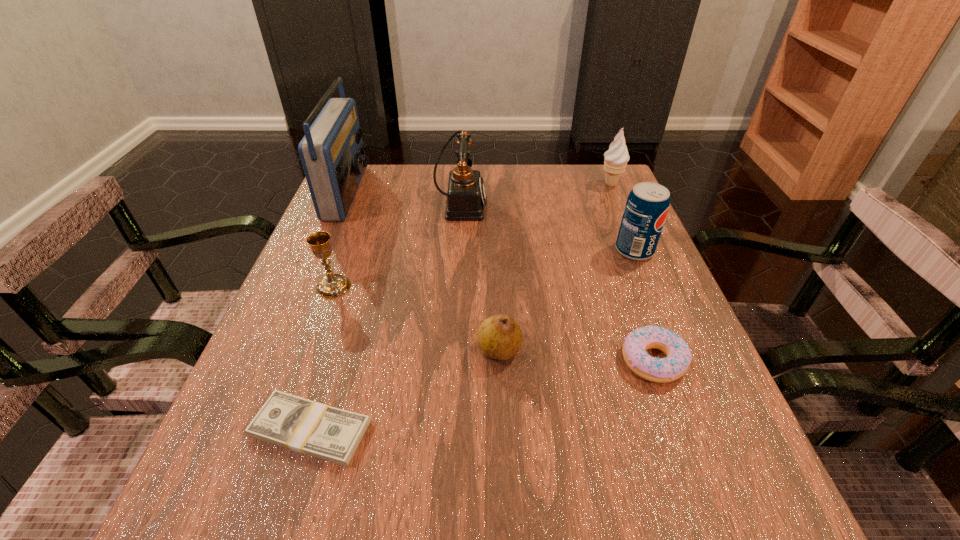
Image resolution: width=960 pixels, height=540 pixels. I want to click on vacant point located between the fifth nearest object and the fourth shortest object, so click(484, 269).

Identify the location of free spot between the telephone and the shortest object. (386, 317).

You are a GUI agent. You are given a task and a screenshot of the screen. Output one action in this format:
    pyautogui.click(x=<x>, y=<y>)
    Task: Click on the free area in between the doughnut and the shortest object
    The width and height of the screenshot is (960, 540).
    Given the screenshot: What is the action you would take?
    pyautogui.click(x=482, y=395)

At what (x,y) coordinates should I click in order to perform the action: click on free spot between the sixth tallest object and the telephone. Please return your answer as a coordinate pair (x, y). The height and width of the screenshot is (540, 960). Looking at the image, I should click on (x=480, y=277).

You are a GUI agent. You are given a task and a screenshot of the screen. Output one action in this format:
    pyautogui.click(x=<x>, y=<y>)
    Task: Click on the free point between the telephone and the pear
    The image size is (960, 540).
    Given the screenshot: What is the action you would take?
    pyautogui.click(x=480, y=277)

Select which object appears as the sixth closest to the pop. Please provide its 2D coordinates. Your answer should be formatted as a tuple, i.e. [(x, y)], where the tuple contains the x and y coordinates of a point satisfying the conditions above.

[(301, 425)]

At what (x,y) coordinates should I click in order to perform the action: click on object that is the third closest one to the pear. Please return your answer as a coordinate pair (x, y). Looking at the image, I should click on (332, 285).

The height and width of the screenshot is (540, 960). I want to click on free location that satisfies the following two spatial constraints: 1. on the front panel of the shortest object; 2. on the left side of the tallest object, so click(x=248, y=430).

I want to click on vacant space that satisfies the following two spatial constraints: 1. on the front panel of the tallest object; 2. on the left side of the dollar, so click(248, 430).

Locate an element on the screen. This screenshot has height=540, width=960. vacant space that satisfies the following two spatial constraints: 1. on the back side of the fifth farthest object; 2. on the front panel of the tallest object is located at coordinates (368, 192).